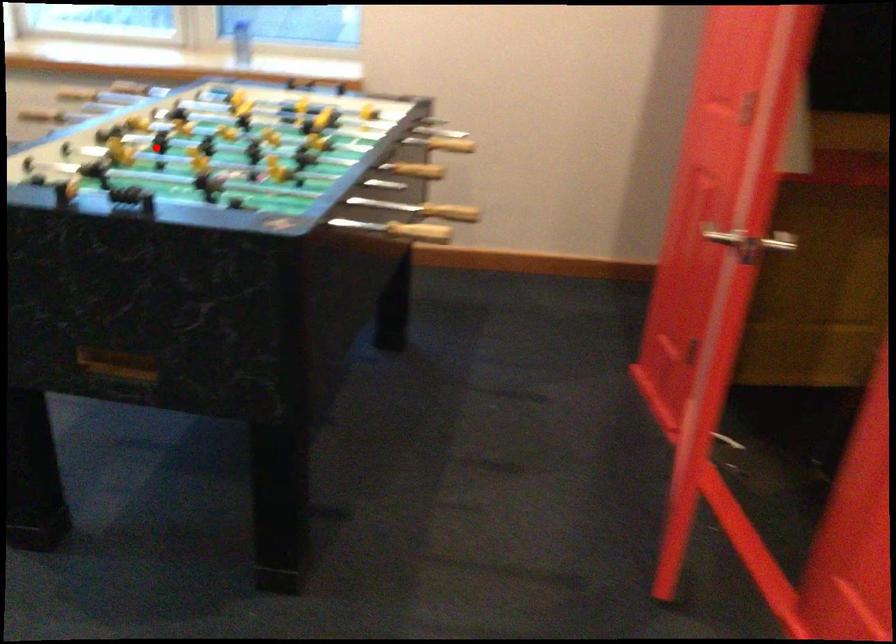
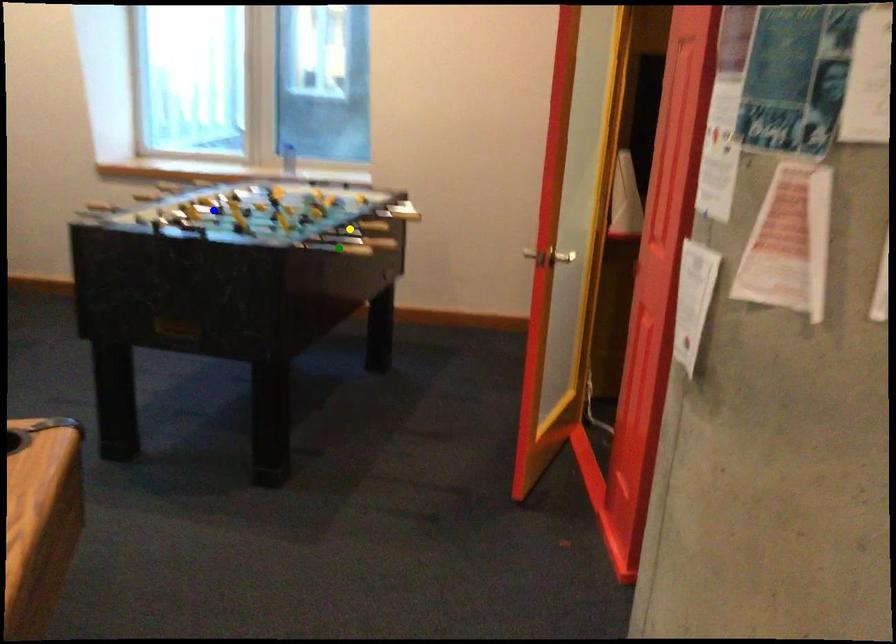
Question: I am providing you with two images of the same scene from different viewpoints. A red point is marked on the first image. You are given multiple points on the second image. Which spot in image 2 lines up with the point in image 1?

Choices:
 (A) yellow point
 (B) green point
 (C) blue point

Answer: (C)